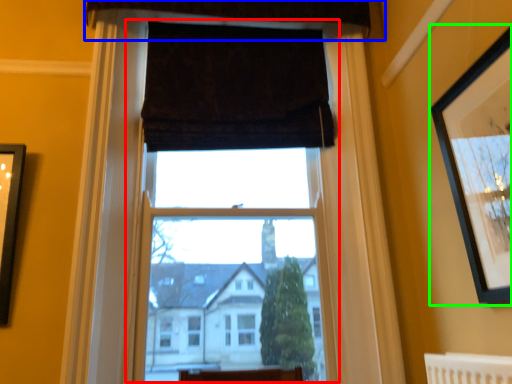
Question: Which is farther away from window frame (highlighted by a red box)? curtain (highlighted by a blue box) or picture frame (highlighted by a green box)?

Choices:
 (A) curtain
 (B) picture frame

Answer: (A)